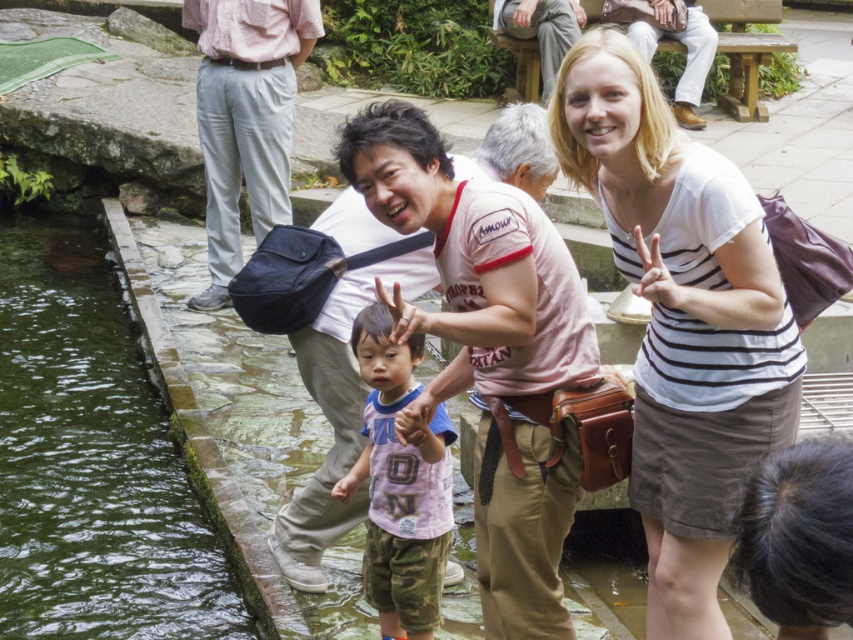
Question: Considering the real-world distances, which object is closest to the matte white shirt at center?

Choices:
 (A) pink cotton shirt at center
 (B) green mossy stone at lower left

Answer: (A)

Question: Which object is farther from the camera taking this photo?

Choices:
 (A) matte white shirt at center
 (B) green mossy stone at lower left
 (C) pink cotton shirt at center

Answer: (B)

Question: Which of the following is the farthest from the observer?

Choices:
 (A) (390, 529)
 (B) (576, 49)

Answer: (A)

Question: Is white striped shirt at center above camo shorts at center?

Choices:
 (A) no
 (B) yes

Answer: (B)

Question: Is white striped shirt at center wider than pink cotton shirt at center?

Choices:
 (A) no
 (B) yes

Answer: (A)

Question: Does camo shorts at center appear over matte white shirt at center?

Choices:
 (A) no
 (B) yes

Answer: (A)